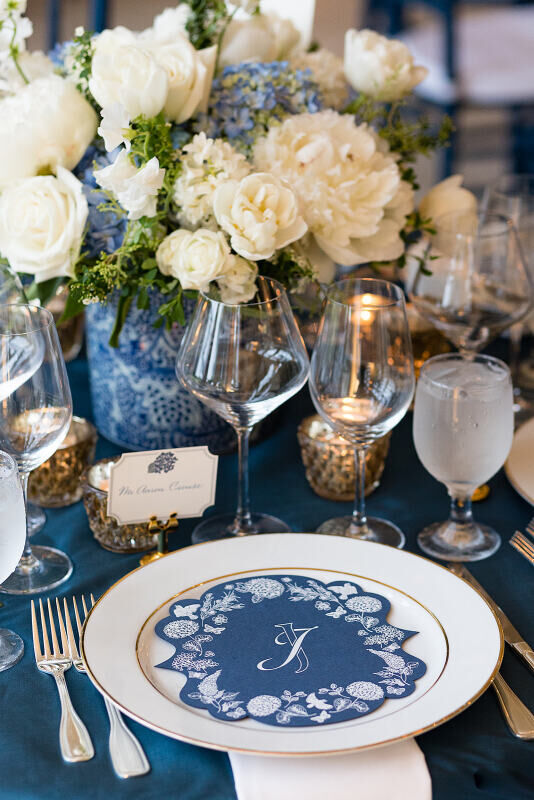
You are a GUI agent. You are given a task and a screenshot of the screen. Output one action in this format:
    pyautogui.click(x=<x>, y=<y>)
    Task: Click on the wine glass
    This screenshot has width=534, height=800.
    Given the screenshot: What is the action you would take?
    pyautogui.click(x=60, y=398), pyautogui.click(x=15, y=289), pyautogui.click(x=248, y=380), pyautogui.click(x=371, y=365), pyautogui.click(x=484, y=422), pyautogui.click(x=493, y=300)